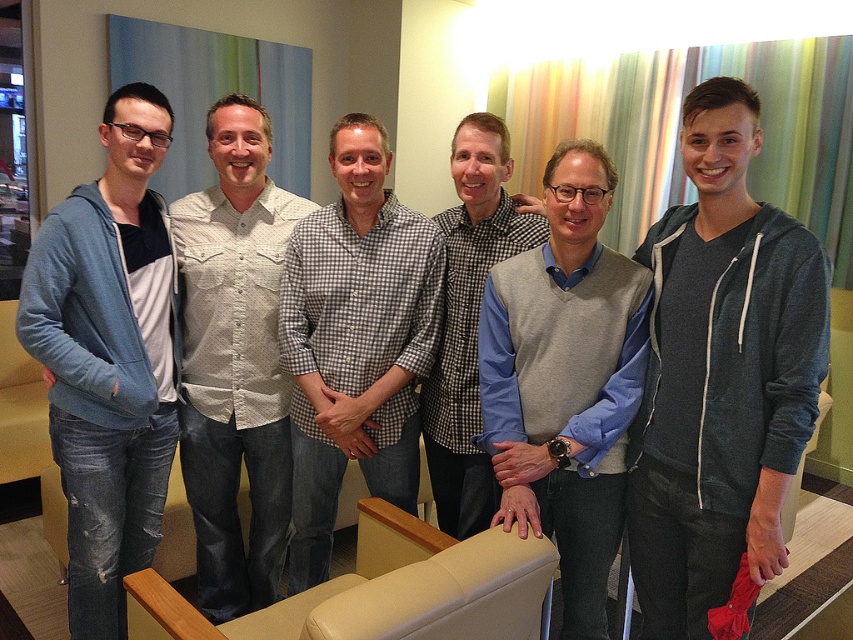
Question: Is light gray sweater vest at center below checkered fabric shirt at center?

Choices:
 (A) no
 (B) yes

Answer: (B)

Question: Based on their relative distances, which object is farther from the checkered shirt at center?

Choices:
 (A) light gray sweater vest at center
 (B) dark gray hoodie at right

Answer: (B)

Question: Which point appears farthest from the camera in this image?

Choices:
 (A) (260, 566)
 (B) (158, 116)

Answer: (A)

Question: Considering the relative positions of light beige textured shirt at center and checkered shirt at center in the image provided, where is light beige textured shirt at center located with respect to checkered shirt at center?

Choices:
 (A) right
 (B) left

Answer: (B)

Question: Which object is positioned farthest from the dark gray hoodie at right?

Choices:
 (A) light beige textured shirt at center
 (B) light gray sweater vest at center
 (C) denim jacket at left
 (D) checkered fabric shirt at center

Answer: (C)

Question: Considering the relative positions of denim jacket at left and checkered fabric shirt at center in the image provided, where is denim jacket at left located with respect to checkered fabric shirt at center?

Choices:
 (A) left
 (B) right

Answer: (A)